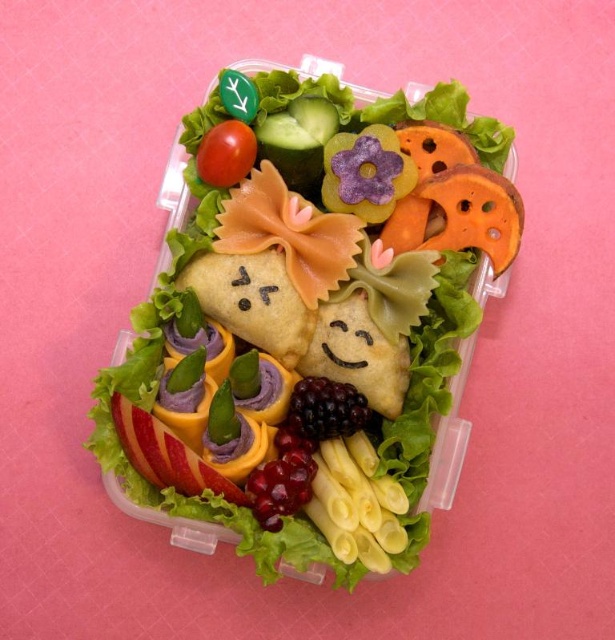
Does blackberry at center have a lesser height compared to red smooth tomato at upper left?

Correct, blackberry at center is not as tall as red smooth tomato at upper left.

Does blackberry at center appear over red smooth tomato at upper left?

No.

Who is more distant from viewer, [314,412] or [226,150]?

The point [226,150] is behind.

At what (x,y) coordinates should I click in order to perform the action: click on blackberry at center. Please return your answer as a coordinate pair (x, y). Looking at the image, I should click on (325, 410).

Is point (360, 284) positioned in front of point (315, 429)?

No, it is behind (315, 429).

Is point (210, 269) farther from camera compared to point (319, 408)?

That is True.

This screenshot has width=615, height=640. In order to click on smooth green lettuce at center in this screenshot , I will do `click(311, 317)`.

In order to click on smooth green lettuce at center in this screenshot , I will do `click(311, 317)`.

Is point (383, 120) positioned in front of point (231, 124)?

That is False.

Is smooth green lettuce at center thinner than red smooth tomato at upper left?

In fact, smooth green lettuce at center might be wider than red smooth tomato at upper left.

You are a GUI agent. You are given a task and a screenshot of the screen. Output one action in this format:
    pyautogui.click(x=<x>, y=<y>)
    Task: Click on the smooth green lettuce at center
    This screenshot has width=615, height=640.
    Given the screenshot: What is the action you would take?
    point(311,317)